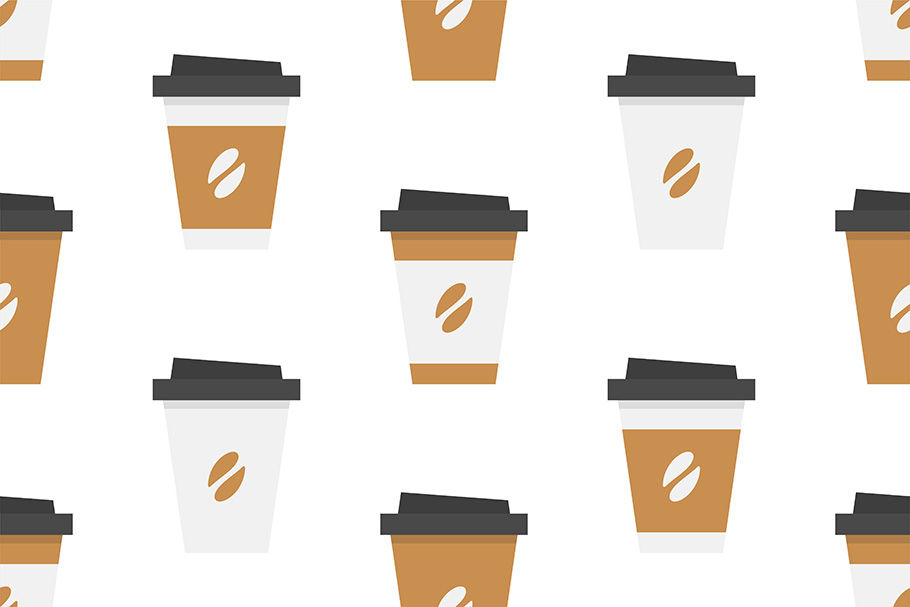
What are the coordinates of `coffee cups with white coffee bean logo` in the screenshot? It's located at (6, 310), (685, 478), (455, 595), (903, 300), (219, 166), (456, 12).